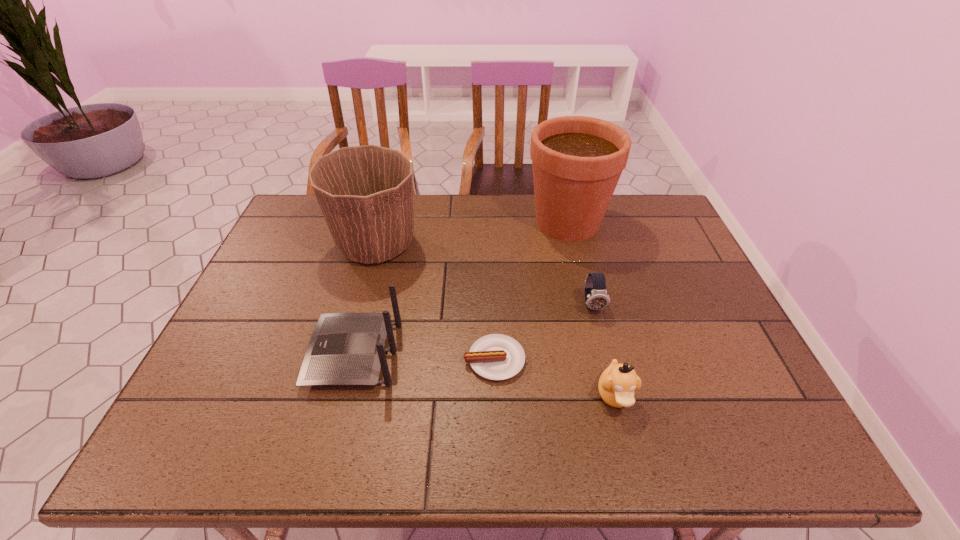
The height and width of the screenshot is (540, 960). What are the coordinates of `vacant space at the far right corner of the desktop` in the screenshot? It's located at (659, 204).

You are a GUI agent. You are given a task and a screenshot of the screen. Output one action in this format:
    pyautogui.click(x=<x>, y=<y>)
    Task: Click on the empty location between the right flowerpot and the duckling
    The width and height of the screenshot is (960, 540).
    Given the screenshot: What is the action you would take?
    pyautogui.click(x=591, y=309)

Where is `vacant area between the duckling and the right flowerpot`? The image size is (960, 540). vacant area between the duckling and the right flowerpot is located at coordinates (x=591, y=309).

Identify the location of empty space that is in between the sausage and the duckling. [x=555, y=378].

This screenshot has height=540, width=960. Find the location of `vacant area between the fourth shortest object and the fourth object from right to left`. vacant area between the fourth shortest object and the fourth object from right to left is located at coordinates (424, 356).

What are the coordinates of `free spot between the third tallest object and the fourth object from right to left` in the screenshot? It's located at (424, 356).

Where is `free point between the router and the third farthest object`? free point between the router and the third farthest object is located at coordinates (473, 329).

The height and width of the screenshot is (540, 960). What are the coordinates of `vacant area that lies between the fourth nearest object and the right flowerpot` in the screenshot? It's located at (580, 264).

Image resolution: width=960 pixels, height=540 pixels. Find the location of `free area in between the watch and the left flowerpot`. free area in between the watch and the left flowerpot is located at coordinates (484, 275).

This screenshot has width=960, height=540. Identify the location of vacant space that is in between the duckling and the third farthest object. (604, 350).